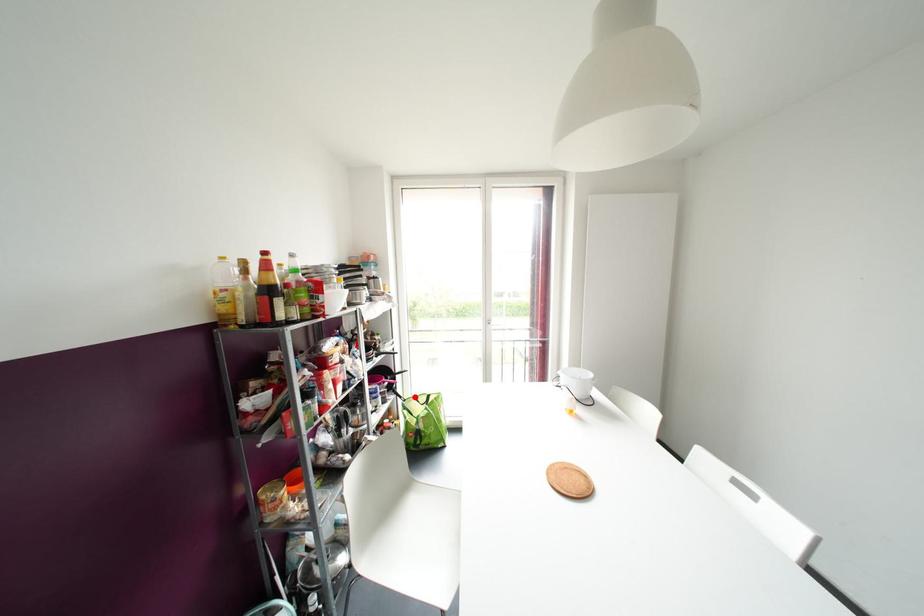
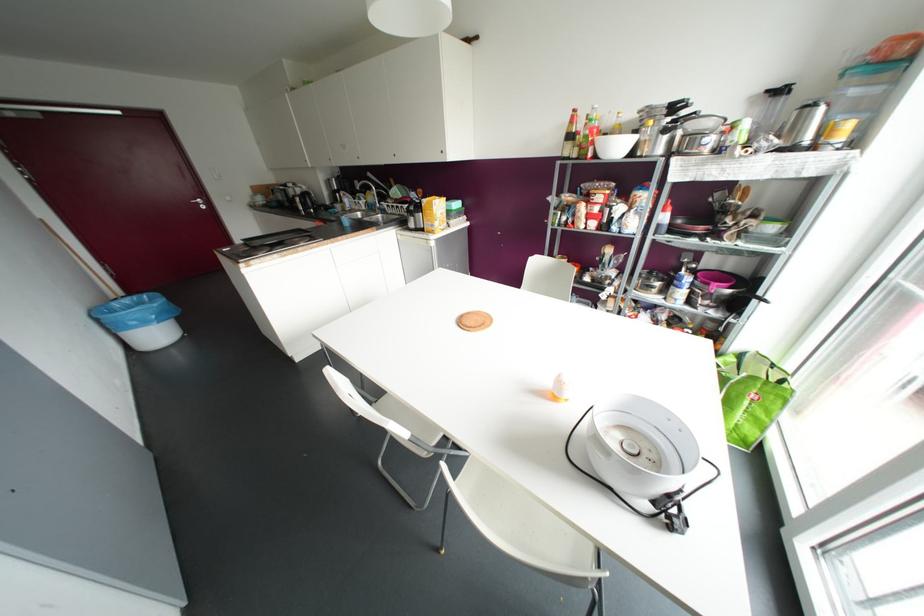
Find the pixel in the second image that matches the highlighted location in the first image.

(772, 365)